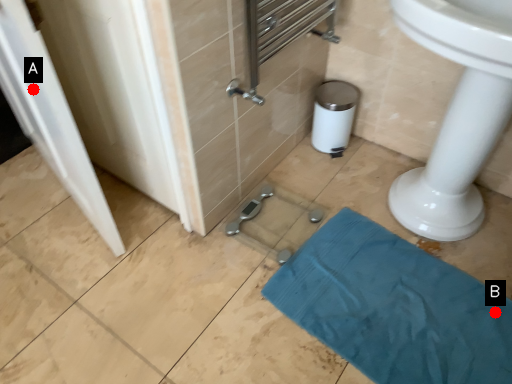
Question: Two points are circled on the image, labeled by A and B beside each circle. Which point is closer to the camera taking this photo?

Choices:
 (A) A is closer
 (B) B is closer

Answer: (A)